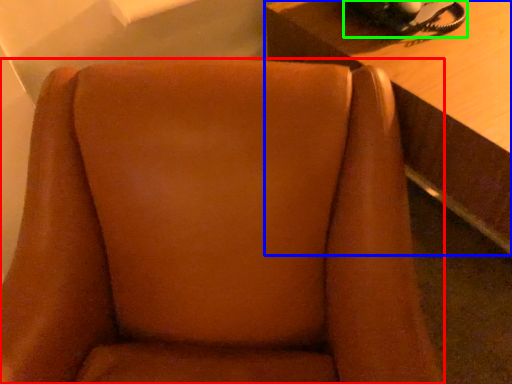
Question: Which is farther away from chair (highlighted by a red box)? table (highlighted by a blue box) or corded phone (highlighted by a green box)?

Choices:
 (A) table
 (B) corded phone

Answer: (B)